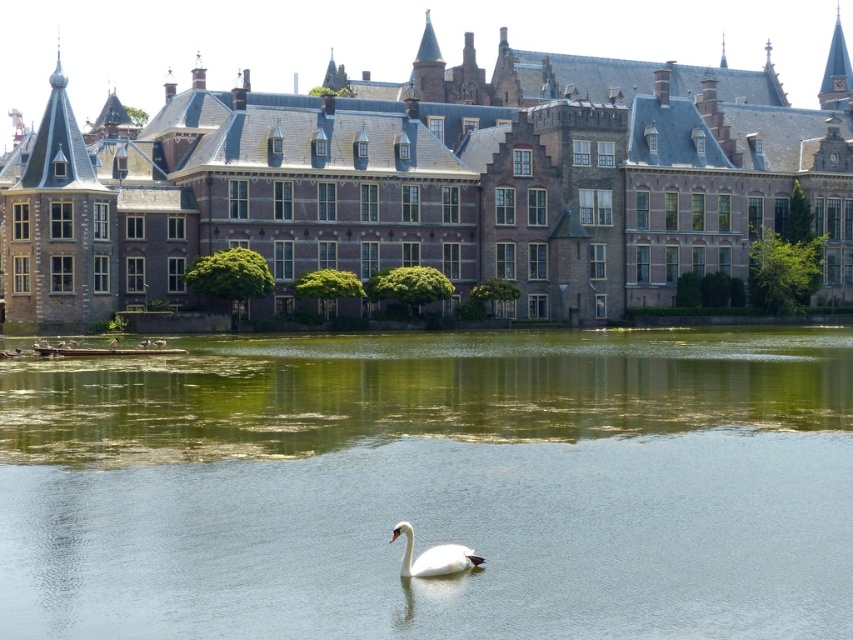
You are standing on the dock and see the clear water at center and the white glossy swan at center. Which object is taller?

The clear water at center is taller than the white glossy swan at center.

You are standing in front of the historic building and want to take a photo that includes both the building and the clear water at center. Where should you position yourself to ensure both elements are in the frame?

To include both the historic building and the clear water at center in your photo, position yourself so that the clear water at center is located at the coordinates approximately 0.761 on the horizontal axis and 0.509 on the vertical axis within your camera frame.